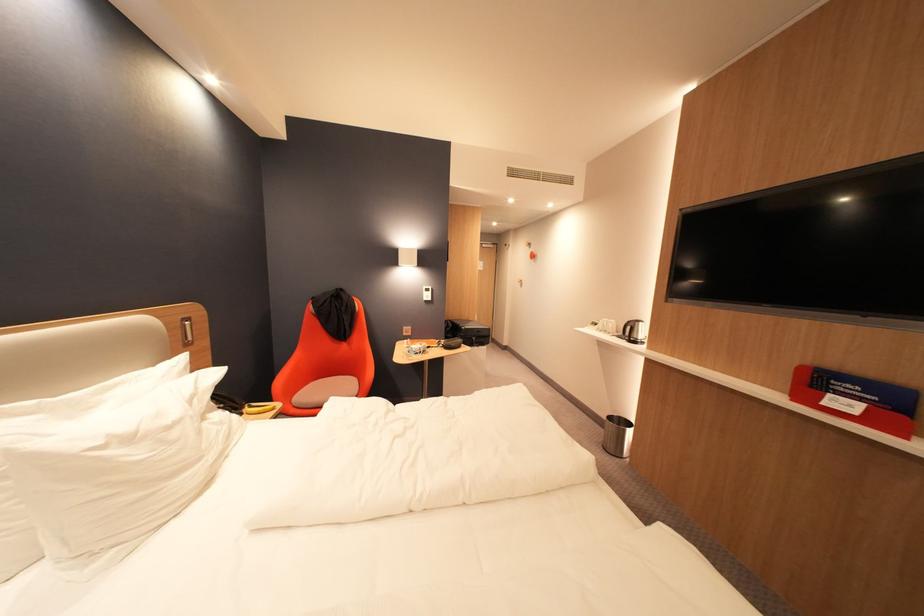
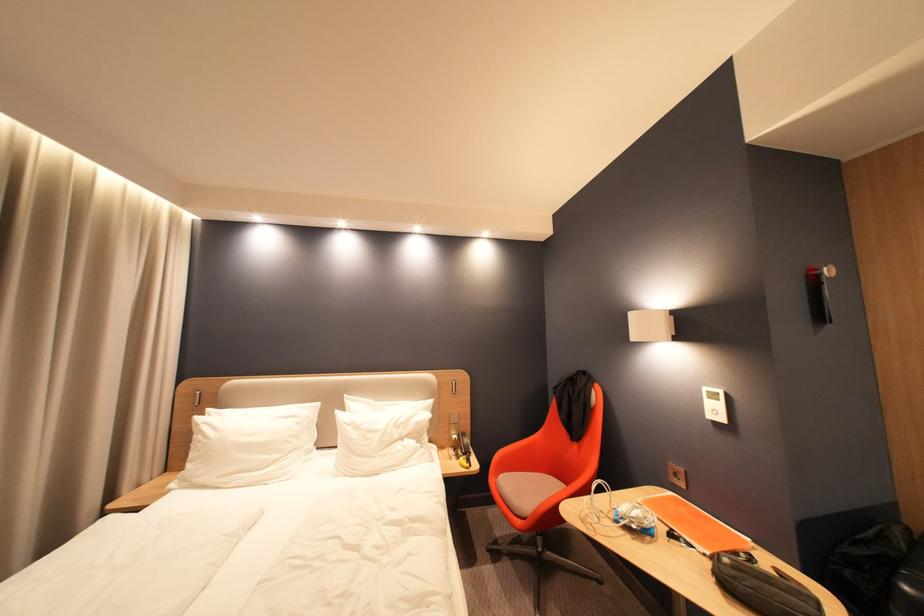
In the second image, find the point that corresponds to point (108, 444) in the first image.

(359, 424)